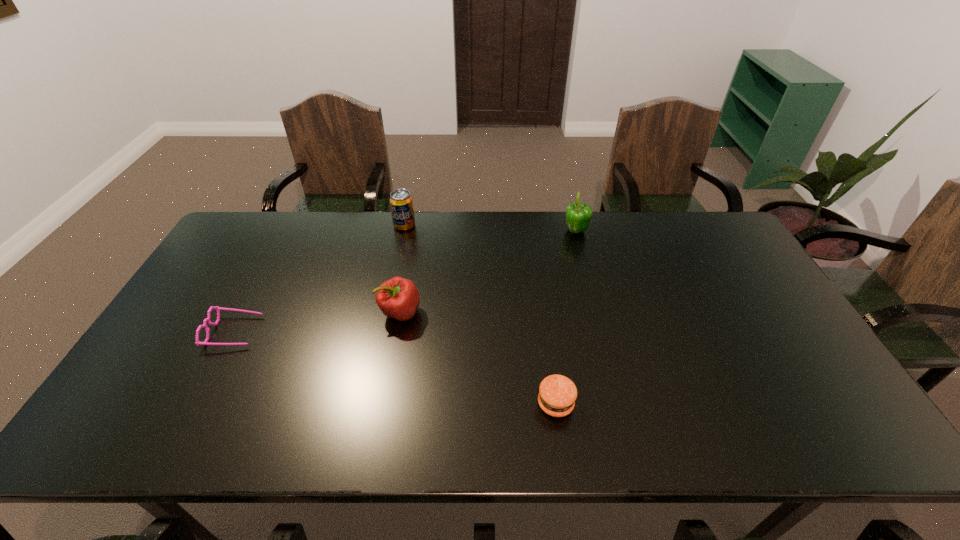
Locate an element on the screen. vacant space located on the right of the soda can is located at coordinates (520, 226).

I want to click on vacant area situated on the back of the left bell pepper, so click(x=405, y=281).

Locate an element on the screen. This screenshot has height=540, width=960. blank area located 0.110m on the right of the second shortest object is located at coordinates (620, 403).

In order to click on free location located on the arms of the spectacles in this screenshot , I will do `click(309, 332)`.

Image resolution: width=960 pixels, height=540 pixels. Identify the location of bell pepper that is at the far edge. [x=578, y=215].

Where is `soda can present at the far edge`? soda can present at the far edge is located at coordinates (401, 203).

Identify the location of object that is at the near edge. The image size is (960, 540). (557, 394).

Find the location of `object that is at the left edge`. object that is at the left edge is located at coordinates (217, 308).

Where is `free space at the far edge`? The image size is (960, 540). free space at the far edge is located at coordinates (322, 231).

In the image, there is a desktop. At what (x,y) coordinates should I click in order to perform the action: click on vacant area at the near edge. Please return your answer as a coordinate pair (x, y). Image resolution: width=960 pixels, height=540 pixels. Looking at the image, I should click on [x=396, y=448].